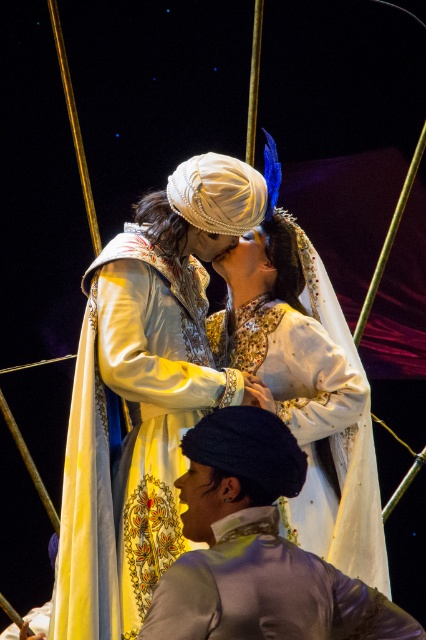
Which of these two, silvery metallic jacket at center or white embroidered dress at center, stands taller?

white embroidered dress at center

From the picture: Who is lower down, silvery metallic jacket at center or white embroidered dress at center?

silvery metallic jacket at center

This screenshot has width=426, height=640. What do you see at coordinates (256, 548) in the screenshot?
I see `silvery metallic jacket at center` at bounding box center [256, 548].

Identify the location of silvery metallic jacket at center. The height and width of the screenshot is (640, 426). (256, 548).

Does point (94, 477) come farther from viewer compared to point (270, 516)?

That is True.

Does silk embroidered dress at center appear over silvery metallic jacket at center?

Indeed, silk embroidered dress at center is positioned over silvery metallic jacket at center.

You are a GUI agent. You are given a task and a screenshot of the screen. Output one action in this format:
    pyautogui.click(x=<x>, y=<y>)
    Task: Click on the silk embroidered dress at center
    
    Given the screenshot: What is the action you would take?
    pyautogui.click(x=206, y=394)

Is point (311, 388) farther from viewer compared to point (241, 356)?

That is False.

Is point (307, 237) in front of point (365, 435)?

No, (307, 237) is further to viewer.

Is point (331, 451) farther from viewer compared to point (288, 262)?

No.

Image resolution: width=426 pixels, height=640 pixels. In order to click on silk embroidered dress at center in this screenshot , I will do [x=206, y=394].